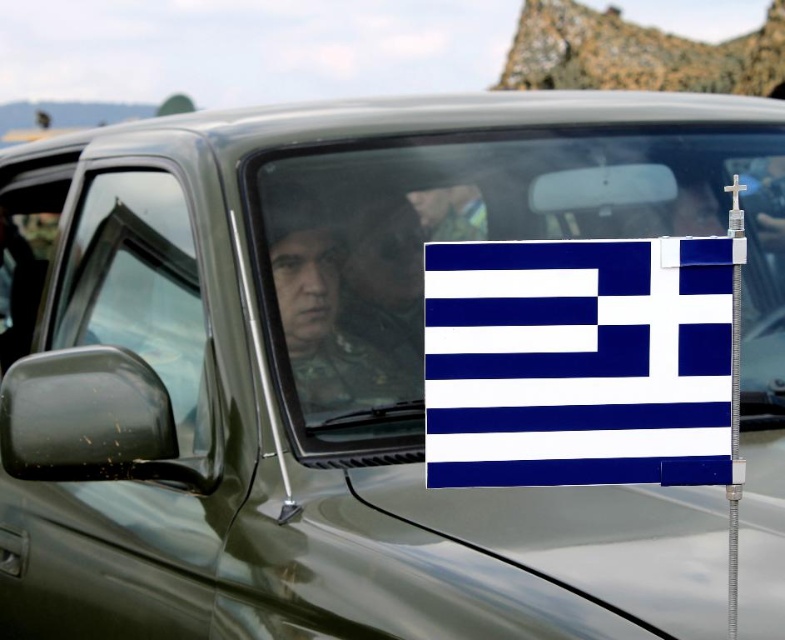
Question: From the image, what is the correct spatial relationship of transparent glass window at left in relation to matte black uniform at center?

Choices:
 (A) above
 (B) below

Answer: (B)

Question: Which point is closer to the camera taking this photo?

Choices:
 (A) (141, 195)
 (B) (623, 134)

Answer: (A)

Question: Among these objects, which one is nearest to the camera?

Choices:
 (A) white matte flag at center
 (B) matte black uniform at center

Answer: (A)

Question: Observing the image, what is the correct spatial positioning of white matte flag at center in reference to blue fabric flag at center?

Choices:
 (A) above
 (B) below

Answer: (A)

Question: Is transparent glass window at left above matte black uniform at center?

Choices:
 (A) no
 (B) yes

Answer: (A)

Question: Which of these objects is positioned closest to the blue fabric flag at center?

Choices:
 (A) matte black uniform at center
 (B) white matte flag at center
 (C) transparent glass window at left

Answer: (B)